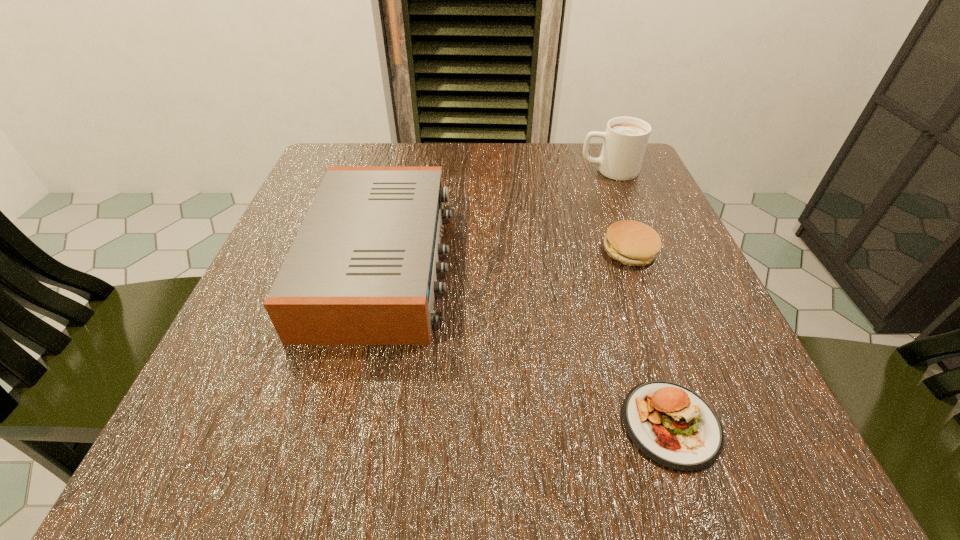
Locate an element on the screen. Image resolution: width=960 pixels, height=540 pixels. vacant space at the far edge is located at coordinates point(411,146).

In order to click on vacant region at the near edge of the desktop in this screenshot , I will do `click(553, 433)`.

This screenshot has height=540, width=960. In the image, there is a desktop. What are the coordinates of `vacant space at the left edge` in the screenshot? It's located at (279, 253).

Where is `vacant space at the right edge of the desktop`? The width and height of the screenshot is (960, 540). vacant space at the right edge of the desktop is located at coordinates (635, 300).

Locate an element on the screen. This screenshot has height=540, width=960. blank space at the far left corner is located at coordinates (373, 160).

Locate an element on the screen. blank space at the far right corner of the desktop is located at coordinates (637, 184).

In the image, there is a desktop. Where is `vacant space at the near right corner`? vacant space at the near right corner is located at coordinates (728, 427).

You are a GUI agent. You are given a task and a screenshot of the screen. Output one action in this format:
    pyautogui.click(x=<x>, y=<y>)
    Task: Click on the vacant space that's between the farthest object and the nearer patty (food)
    The height and width of the screenshot is (540, 960).
    Given the screenshot: What is the action you would take?
    pyautogui.click(x=639, y=297)

Locate an element on the screen. This screenshot has width=960, height=540. free area in between the leftmost object and the tallest object is located at coordinates (495, 217).

Locate an element on the screen. Image resolution: width=960 pixels, height=540 pixels. vacant point located between the taller patty (food) and the leftmost object is located at coordinates click(506, 257).